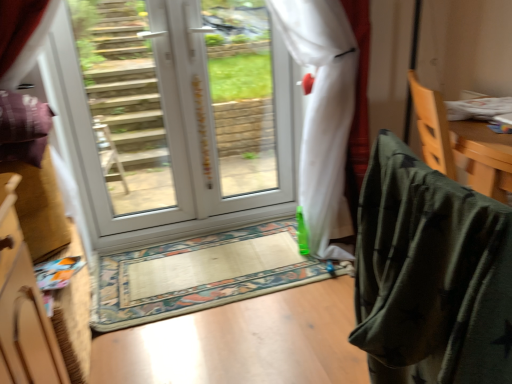
Question: From the image's perspective, is transparent plastic window screen at center on top of wooden cabinet at left?

Choices:
 (A) yes
 (B) no

Answer: (A)

Question: Can you confirm if transparent plastic window screen at center is shorter than wooden cabinet at left?

Choices:
 (A) yes
 (B) no

Answer: (B)

Question: Could you tell me if transparent plastic window screen at center is facing wooden cabinet at left?

Choices:
 (A) yes
 (B) no

Answer: (B)

Question: Is transparent plastic window screen at center smaller than wooden cabinet at left?

Choices:
 (A) yes
 (B) no

Answer: (B)

Question: Is transparent plastic window screen at center completely or partially outside of wooden cabinet at left?

Choices:
 (A) yes
 (B) no

Answer: (A)

Question: Does transparent plastic window screen at center have a larger size compared to wooden cabinet at left?

Choices:
 (A) no
 (B) yes

Answer: (B)

Question: From a real-world perspective, is white glossy glass door at upper center located beneath white glossy door at center?

Choices:
 (A) yes
 (B) no

Answer: (B)

Question: Does white glossy glass door at upper center have a lesser height compared to white glossy door at center?

Choices:
 (A) yes
 (B) no

Answer: (A)

Question: Is white glossy glass door at upper center looking in the opposite direction of white glossy door at center?

Choices:
 (A) yes
 (B) no

Answer: (A)

Question: Is white glossy glass door at upper center smaller than white glossy door at center?

Choices:
 (A) no
 (B) yes

Answer: (B)

Question: Is white glossy glass door at upper center next to white glossy door at center and touching it?

Choices:
 (A) no
 (B) yes

Answer: (A)

Question: Is white glossy door at center completely or partially inside white glossy glass door at upper center?

Choices:
 (A) yes
 (B) no

Answer: (A)

Question: Is transparent plastic window screen at center smaller than white glossy door at center?

Choices:
 (A) no
 (B) yes

Answer: (B)